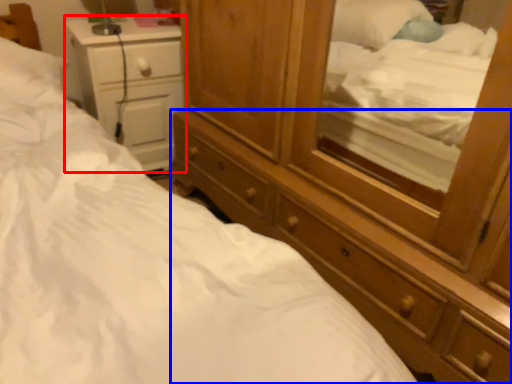
Question: Which of the following is the farthest to the observer, nightstand (highlighted by a red box) or dresser (highlighted by a blue box)?

Choices:
 (A) nightstand
 (B) dresser

Answer: (A)